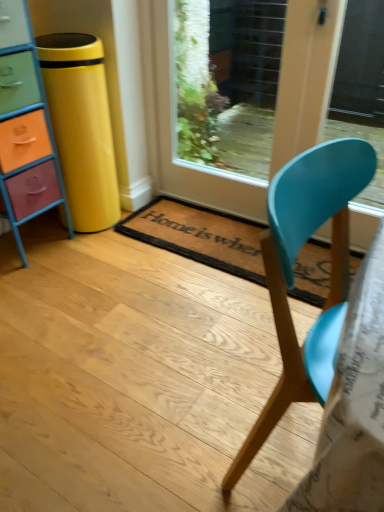
Question: From a real-world perspective, is multicolored painted wood chest of drawers at left below brown coir mat at center?

Choices:
 (A) yes
 (B) no

Answer: (B)

Question: Is multicolored painted wood chest of drawers at left directly adjacent to brown coir mat at center?

Choices:
 (A) no
 (B) yes

Answer: (A)

Question: Is the depth of multicolored painted wood chest of drawers at left greater than that of brown coir mat at center?

Choices:
 (A) no
 (B) yes

Answer: (A)

Question: Is multicolored painted wood chest of drawers at left not within brown coir mat at center?

Choices:
 (A) no
 (B) yes

Answer: (B)

Question: From a real-world perspective, is multicolored painted wood chest of drawers at left on top of brown coir mat at center?

Choices:
 (A) no
 (B) yes

Answer: (B)

Question: Is multicolored painted wood chest of drawers at left wider than brown coir mat at center?

Choices:
 (A) yes
 (B) no

Answer: (B)

Question: From the image's perspective, would you say multicolored painted wood chest of drawers at left is shown under matte blue chair at center?

Choices:
 (A) yes
 (B) no

Answer: (B)

Question: Is multicolored painted wood chest of drawers at left at the right side of matte blue chair at center?

Choices:
 (A) no
 (B) yes

Answer: (A)

Question: Is multicolored painted wood chest of drawers at left completely or partially outside of matte blue chair at center?

Choices:
 (A) no
 (B) yes

Answer: (B)

Question: Does multicolored painted wood chest of drawers at left come in front of matte blue chair at center?

Choices:
 (A) no
 (B) yes

Answer: (A)

Question: Can you confirm if multicolored painted wood chest of drawers at left is thinner than matte blue chair at center?

Choices:
 (A) yes
 (B) no

Answer: (A)

Question: Is multicolored painted wood chest of drawers at left surrounding matte blue chair at center?

Choices:
 (A) yes
 (B) no

Answer: (B)

Question: Is brown coir mat at center directly adjacent to wooden glass door at center?

Choices:
 (A) yes
 (B) no

Answer: (B)